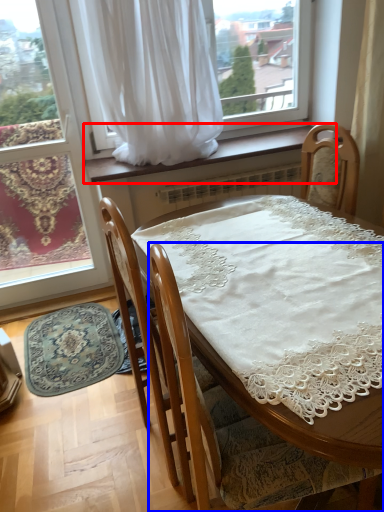
Question: Which point is further to the camera, window sill (highlighted by a red box) or chair (highlighted by a blue box)?

Choices:
 (A) window sill
 (B) chair

Answer: (A)